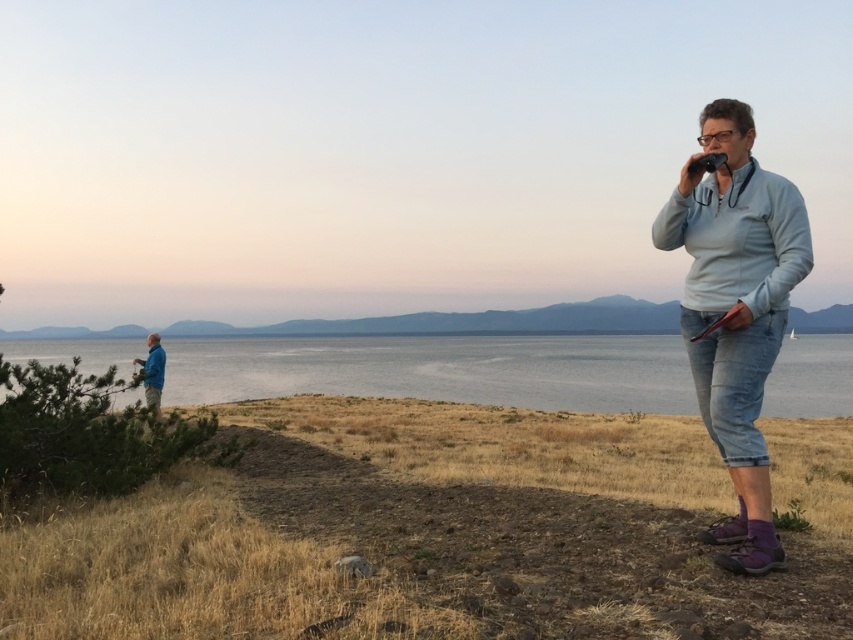
Which is more to the right, light blue fabric jacket at right or blue fabric jacket at left?

light blue fabric jacket at right

Who is more forward, (x=730, y=525) or (x=155, y=339)?

Positioned in front is point (x=730, y=525).

This screenshot has height=640, width=853. I want to click on light blue fabric jacket at right, so click(x=735, y=308).

Is smooth blue water at center smaller than light blue fleece at right?

Incorrect, smooth blue water at center is not smaller in size than light blue fleece at right.

Who is positioned more to the right, smooth blue water at center or light blue fleece at right?

smooth blue water at center is more to the right.

Does point (840, 372) come farther from viewer compared to point (780, 264)?

That is True.

Find the location of a particular element. smooth blue water at center is located at coordinates (440, 371).

Which of these two, light blue fabric jacket at right or light blue fleece at right, stands taller?

light blue fabric jacket at right is taller.

Who is shorter, light blue fabric jacket at right or light blue fleece at right?

With less height is light blue fleece at right.

Is point (740, 230) positioned in front of point (779, 205)?

No, (740, 230) is further to viewer.

What are the coordinates of `light blue fabric jacket at right` in the screenshot? It's located at pyautogui.click(x=735, y=308).